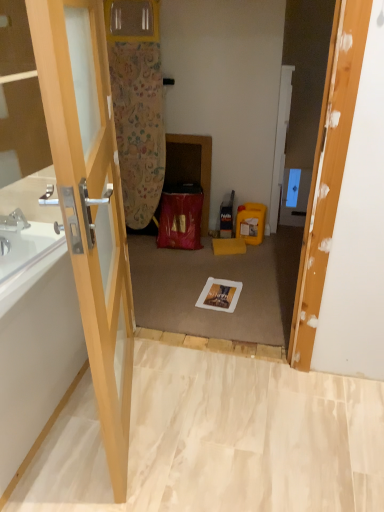
This screenshot has width=384, height=512. I want to click on transparent glass door at left, so click(89, 196).

What do you see at coordinates (89, 196) in the screenshot? The width and height of the screenshot is (384, 512). I see `transparent glass door at left` at bounding box center [89, 196].

In the scene shown: Measure the distance between white glossy bathtub at left and camera.

white glossy bathtub at left and camera are 1.25 meters apart.

This screenshot has width=384, height=512. In order to click on white glossy bathtub at left in this screenshot , I will do `click(37, 362)`.

The height and width of the screenshot is (512, 384). Describe the element at coordinates (37, 362) in the screenshot. I see `white glossy bathtub at left` at that location.

Locate an element on the screen. The width and height of the screenshot is (384, 512). transparent glass door at left is located at coordinates (89, 196).

Would you say transparent glass door at left is to the left or to the right of white glossy bathtub at left in the picture?

transparent glass door at left is positioned on white glossy bathtub at left's right side.

Which is in front, transparent glass door at left or white glossy bathtub at left?

transparent glass door at left is more forward.

Considering the positions of point (84, 236) and point (57, 359), is point (84, 236) closer or farther from the camera than point (57, 359)?

Clearly, point (84, 236) is closer to the camera than point (57, 359).

From the image's perspective, which one is positioned lower, transparent glass door at left or white glossy bathtub at left?

white glossy bathtub at left.

From a real-world perspective, does transparent glass door at left stand above white glossy bathtub at left?

Yes, from a real-world perspective, transparent glass door at left is over white glossy bathtub at left

Which of these two, transparent glass door at left or white glossy bathtub at left, is wider?

With larger width is white glossy bathtub at left.

Is transparent glass door at left shorter than white glossy bathtub at left?

In fact, transparent glass door at left may be taller than white glossy bathtub at left.

Does transparent glass door at left have a larger size compared to white glossy bathtub at left?

Incorrect, transparent glass door at left is not larger than white glossy bathtub at left.

Is transparent glass door at left surrounding white glossy bathtub at left?

No.

Does transparent glass door at left touch white glossy bathtub at left?

No, transparent glass door at left is not with white glossy bathtub at left.

Is white glossy bathtub at left at the back of transparent glass door at left?

Absolutely, transparent glass door at left is directed away from white glossy bathtub at left.

How many degrees apart are the facing directions of transparent glass door at left and white glossy bathtub at left?

18 degrees.

In the image, there is a transparent glass door at left. Where is `bath below it (from a real-world perspective)`? This screenshot has width=384, height=512. bath below it (from a real-world perspective) is located at coordinates (37, 362).

Between white glossy bathtub at left and transparent glass door at left, which one appears on the right side from the viewer's perspective?

transparent glass door at left is more to the right.

Which object is closer to the camera, white glossy bathtub at left or transparent glass door at left?

transparent glass door at left.

Does point (47, 352) come behind point (93, 280)?

Yes, it is.

From the image's perspective, is white glossy bathtub at left above or below transparent glass door at left?

From the image's perspective, white glossy bathtub at left appears below transparent glass door at left.

From a real-world perspective, is white glossy bathtub at left positioned under transparent glass door at left based on gravity?

Indeed, from a real-world perspective, white glossy bathtub at left is positioned beneath transparent glass door at left.

Is white glossy bathtub at left thinner than transparent glass door at left?

No.

Does white glossy bathtub at left have a greater height compared to transparent glass door at left?

Incorrect, the height of white glossy bathtub at left is not larger of that of transparent glass door at left.

Considering the sizes of objects white glossy bathtub at left and transparent glass door at left in the image provided, who is smaller, white glossy bathtub at left or transparent glass door at left?

Smaller between the two is transparent glass door at left.

Is white glossy bathtub at left spatially inside transparent glass door at left, or outside of it?

white glossy bathtub at left exists outside the volume of transparent glass door at left.

Are white glossy bathtub at left and transparent glass door at left far apart?

Actually, white glossy bathtub at left and transparent glass door at left are a little close together.

Does white glossy bathtub at left turn towards transparent glass door at left?

Yes, white glossy bathtub at left is facing transparent glass door at left.

What's the angular difference between white glossy bathtub at left and transparent glass door at left's facing directions?

18 degrees.

The width and height of the screenshot is (384, 512). I want to click on door above the white glossy bathtub at left (from the image's perspective), so click(x=89, y=196).

Image resolution: width=384 pixels, height=512 pixels. In order to click on bath behind the transparent glass door at left in this screenshot , I will do `click(37, 362)`.

Identify the location of bath below the transparent glass door at left (from a real-world perspective). This screenshot has width=384, height=512. (37, 362).